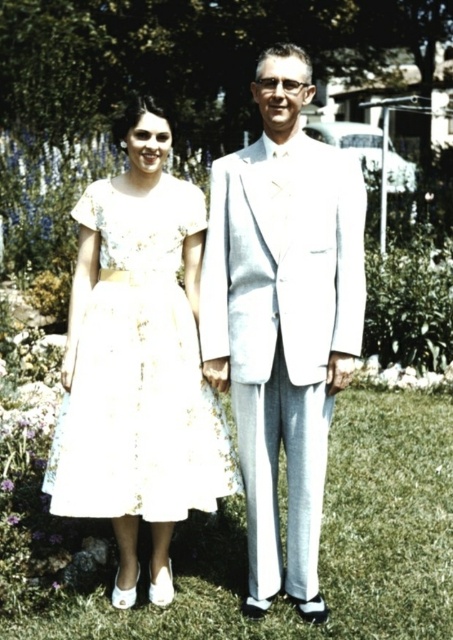
You are standing at the origin of the coordinate system in the garden. The light gray suit at center is located at point (283, 317). If you want to walk straight towards the light gray suit at center, which direction should you move?

Since the light gray suit at center is located at point (283, 317), you should move in the direction of that coordinate to reach it.

From the picture: You are planning to borrow a jacket from either the light gray suit at center or the white lace dress at center. Which one would you choose if you need a larger size?

The light gray suit at center has a larger size compared to the white lace dress at center, so you should choose the light gray suit at center.